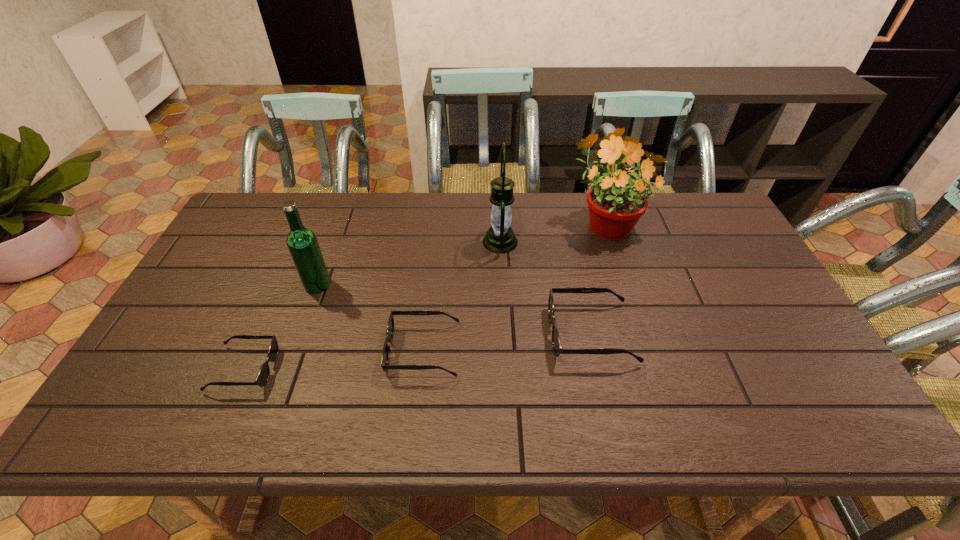
Identify the location of the shortest object. (263, 375).

At what (x,y) coordinates should I click in order to perform the action: click on the shortest sunglasses. Please return your answer as a coordinate pair (x, y). The height and width of the screenshot is (540, 960). Looking at the image, I should click on (263, 375).

What are the coordinates of `the second sunglasses from right to left` in the screenshot? It's located at (390, 327).

The image size is (960, 540). I want to click on the fourth object from right to left, so click(x=390, y=327).

I want to click on the fourth tallest object, so click(556, 344).

Where is `the tallest sunglasses`? This screenshot has height=540, width=960. the tallest sunglasses is located at coordinates (556, 344).

Locate an element on the screen. flowerpot is located at coordinates (616, 202).

Identify the location of lantern. This screenshot has width=960, height=540. (500, 238).

At what (x,y) coordinates should I click in order to perform the action: click on beer bottle. Please return your answer as a coordinate pair (x, y). Looking at the image, I should click on (302, 243).

Find the location of a particular element. the fourth nearest object is located at coordinates (302, 243).